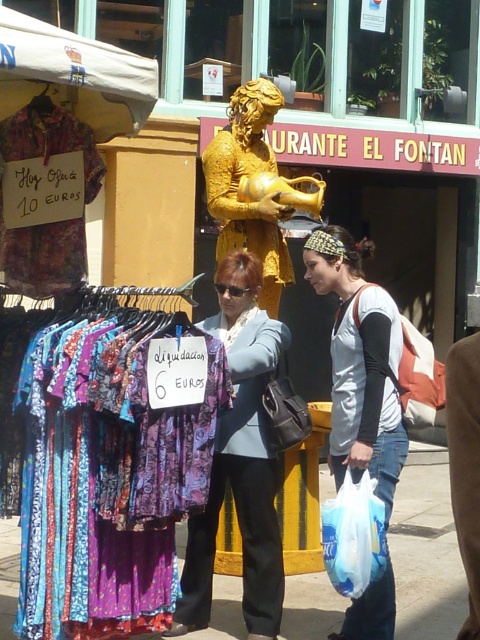
From the picture: You are shopping at a market stall and see a floral fabric dress at left and a white plastic bag at lower right. Which item is bigger in size?

The floral fabric dress at left has a larger size compared to the white plastic bag at lower right.